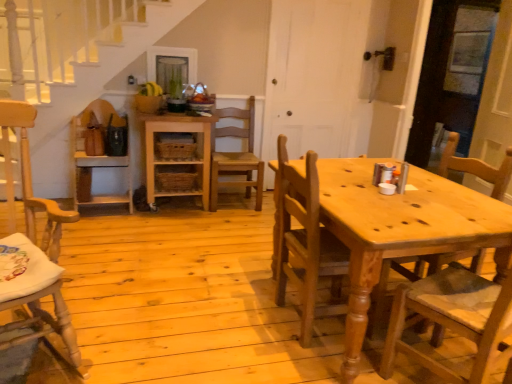
This screenshot has width=512, height=384. In order to click on vacant space that's between natural wood chair at center, which appears as the second chair when viewed from the right, and natural wood shelf at center in this screenshot , I will do `click(218, 256)`.